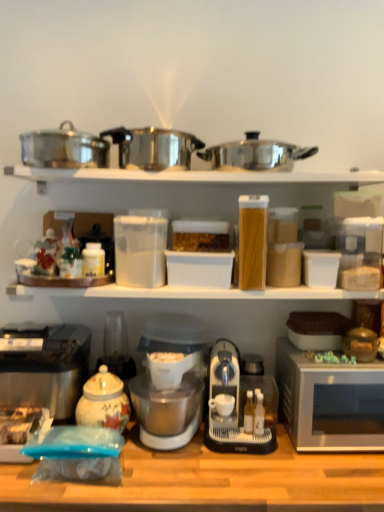
Question: Is clear plastic container at upper center, acting as the 2th appliance starting from the left, further to camera compared to wooden table at lower center?

Choices:
 (A) no
 (B) yes

Answer: (B)

Question: Is clear plastic container at upper center, the 2th appliance from the bottom, completely or partially outside of wooden table at lower center?

Choices:
 (A) no
 (B) yes

Answer: (B)

Question: Is clear plastic container at upper center, acting as the 2th appliance starting from the left, to the right of wooden table at lower center from the viewer's perspective?

Choices:
 (A) no
 (B) yes

Answer: (B)

Question: Does clear plastic container at upper center, the 2th appliance from the bottom, have a smaller size compared to wooden table at lower center?

Choices:
 (A) yes
 (B) no

Answer: (A)

Question: Is clear plastic container at upper center, the 2th appliance from the bottom, closer to camera compared to wooden table at lower center?

Choices:
 (A) no
 (B) yes

Answer: (A)

Question: In the image, is silver metallic microwave at right on the left side or the right side of metallic silver toaster at lower left?

Choices:
 (A) right
 (B) left

Answer: (A)

Question: From the image's perspective, is silver metallic microwave at right positioned above or below metallic silver toaster at lower left?

Choices:
 (A) below
 (B) above

Answer: (A)

Question: Is point (345, 441) positioned closer to the camera than point (76, 388)?

Choices:
 (A) farther
 (B) closer

Answer: (B)

Question: Based on their sizes in the image, would you say silver metallic microwave at right is bigger or smaller than metallic silver toaster at lower left?

Choices:
 (A) small
 (B) big

Answer: (B)

Question: In the image, is wooden table at lower center positioned in front of or behind metallic silver toaster at lower left?

Choices:
 (A) front
 (B) behind

Answer: (A)

Question: From the image's perspective, is wooden table at lower center above or below metallic silver toaster at lower left?

Choices:
 (A) above
 (B) below

Answer: (B)

Question: In terms of size, does wooden table at lower center appear bigger or smaller than metallic silver toaster at lower left?

Choices:
 (A) big
 (B) small

Answer: (A)

Question: Based on their positions, is wooden table at lower center located to the left or right of metallic silver toaster at lower left?

Choices:
 (A) right
 (B) left

Answer: (A)

Question: Considering the positions of clear plastic container at upper center, the 2th appliance from the bottom, and white plastic coffee maker at center in the image, is clear plastic container at upper center, the 2th appliance from the bottom, bigger or smaller than white plastic coffee maker at center?

Choices:
 (A) small
 (B) big

Answer: (A)

Question: Which is correct: clear plastic container at upper center, the 2th appliance from the bottom, is inside white plastic coffee maker at center, or outside of it?

Choices:
 (A) outside
 (B) inside

Answer: (A)